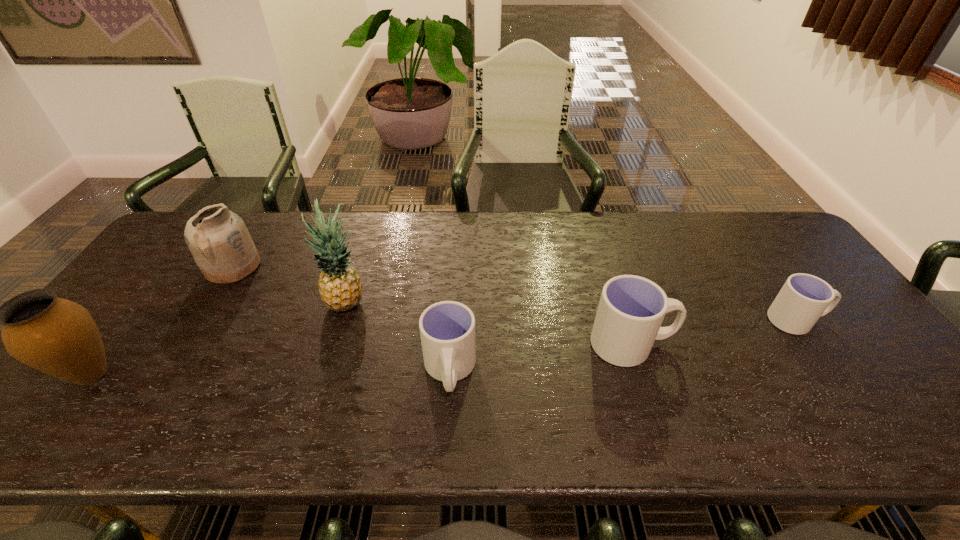
What are the coordinates of `free region located 0.300m with the handle on the side of the fifth object from left to right` in the screenshot? It's located at (793, 345).

This screenshot has width=960, height=540. I want to click on vacant space located 0.080m with the handle on the side of the shortest cup, so click(855, 320).

You are a GUI agent. You are given a task and a screenshot of the screen. Output one action in this format:
    pyautogui.click(x=<x>, y=<y>)
    Task: Click on the blank area located on the right of the fifth object from right to left
    
    Given the screenshot: What is the action you would take?
    pyautogui.click(x=370, y=267)

What are the coordinates of `vacant space located on the back of the pineapple` in the screenshot? It's located at (359, 266).

Find the location of `free space located 0.330m on the right of the leftmost object`. free space located 0.330m on the right of the leftmost object is located at coordinates (261, 373).

Where is `object present at the far edge`? The image size is (960, 540). object present at the far edge is located at coordinates (218, 239).

Image resolution: width=960 pixels, height=540 pixels. In order to click on cup that is at the near edge in this screenshot , I will do `click(447, 328)`.

What are the coordinates of `urn at the near edge` in the screenshot? It's located at (59, 337).

Image resolution: width=960 pixels, height=540 pixels. I want to click on object present at the left edge, so click(x=59, y=337).

Find the location of a particular element. This screenshot has height=540, width=960. object that is at the right edge is located at coordinates (804, 298).